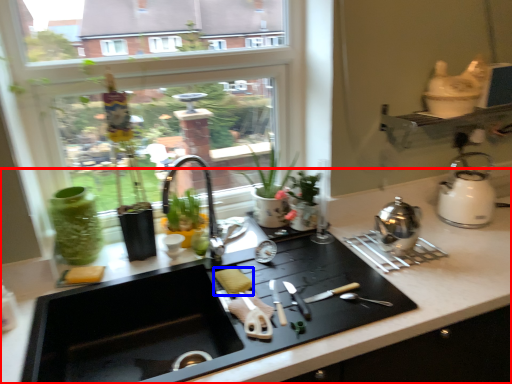
Question: Among these objects, which one is nearest to the camera, countertop (highlighted by a red box) or food (highlighted by a blue box)?

Choices:
 (A) countertop
 (B) food

Answer: (A)